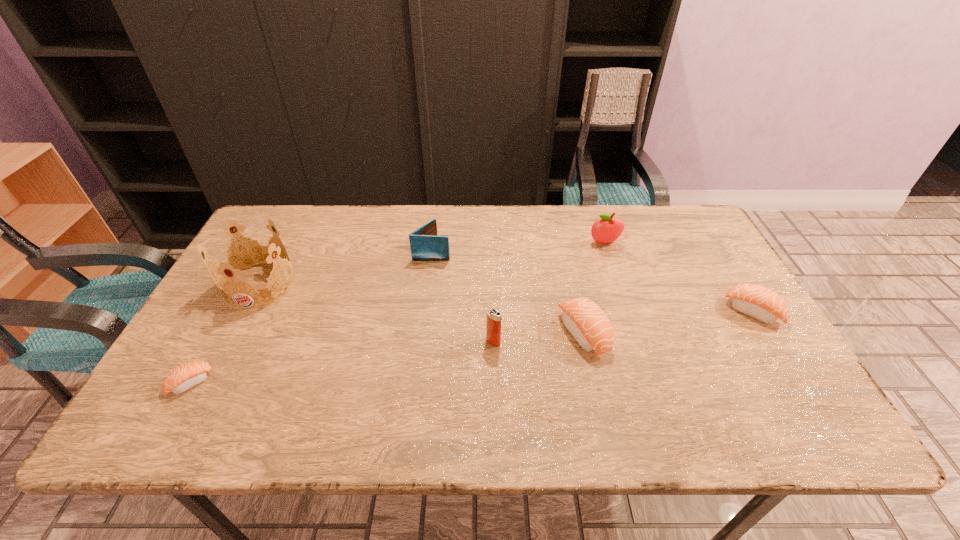
Locate an element on the screen. The image size is (960, 540). free space located 0.140m on the back of the nearest sushi is located at coordinates (225, 322).

Where is `free space located 0.400m on the right of the second sushi from left to right`? This screenshot has width=960, height=540. free space located 0.400m on the right of the second sushi from left to right is located at coordinates click(764, 333).

This screenshot has width=960, height=540. I want to click on free region located on the back of the second shortest object, so click(707, 235).

Find the location of a particular element. vacant space situated 0.380m on the front of the apple is located at coordinates (637, 344).

I want to click on free space located 0.210m on the exterior surface of the fourth shortest object, so click(519, 252).

Find the location of a particular element. This screenshot has width=960, height=540. free space located 0.180m on the right of the igniter is located at coordinates (573, 342).

The height and width of the screenshot is (540, 960). In order to click on free region located 0.120m on the front of the tallest object in this screenshot , I will do `click(228, 345)`.

This screenshot has height=540, width=960. Identify the location of apple positioned at the far edge. (607, 229).

Identify the location of wallet located in the far edge section of the desktop. (425, 245).

This screenshot has height=540, width=960. I want to click on object that is at the near edge, so click(184, 377).